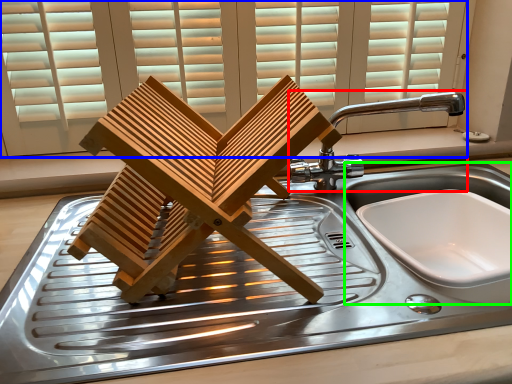
Question: Which is nearer to the tap (highlighted by a red box)? window (highlighted by a blue box) or sink (highlighted by a green box).

Choices:
 (A) window
 (B) sink

Answer: (B)